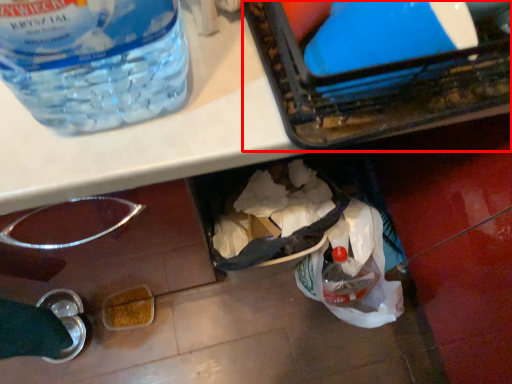
Question: From the image's perspective, what is the correct spatial relationship of box (annotated by the red box) in relation to bottle?

Choices:
 (A) above
 (B) below

Answer: (B)